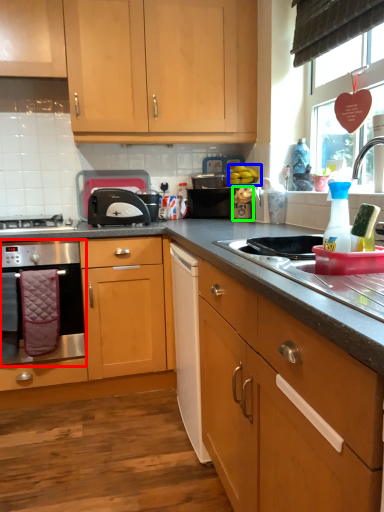
Question: Based on their relative distances, which object is farther from home appliance (highlighted by a red box)? Choose from fruit (highlighted by a blue box) and appliance (highlighted by a green box).

Choices:
 (A) fruit
 (B) appliance

Answer: (A)